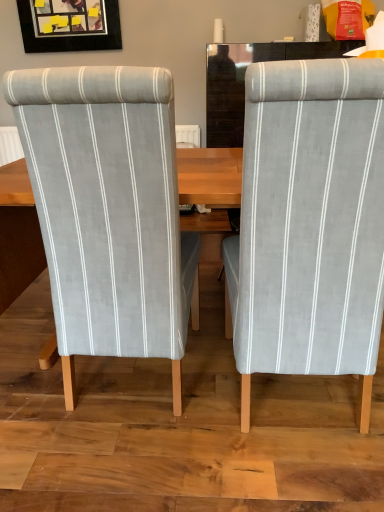
I want to click on vacant area situated below light gray fabric chair at right, which is the second chair in left-to-right order (from a real-world perspective), so click(289, 402).